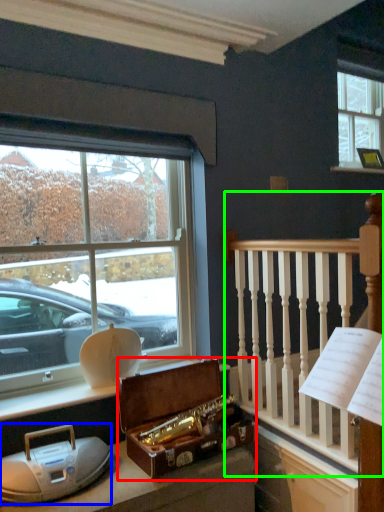
Question: Which is nearer to the box (highlighted by a red box)? artifact (highlighted by a blue box) or rail (highlighted by a green box).

Choices:
 (A) artifact
 (B) rail

Answer: (A)